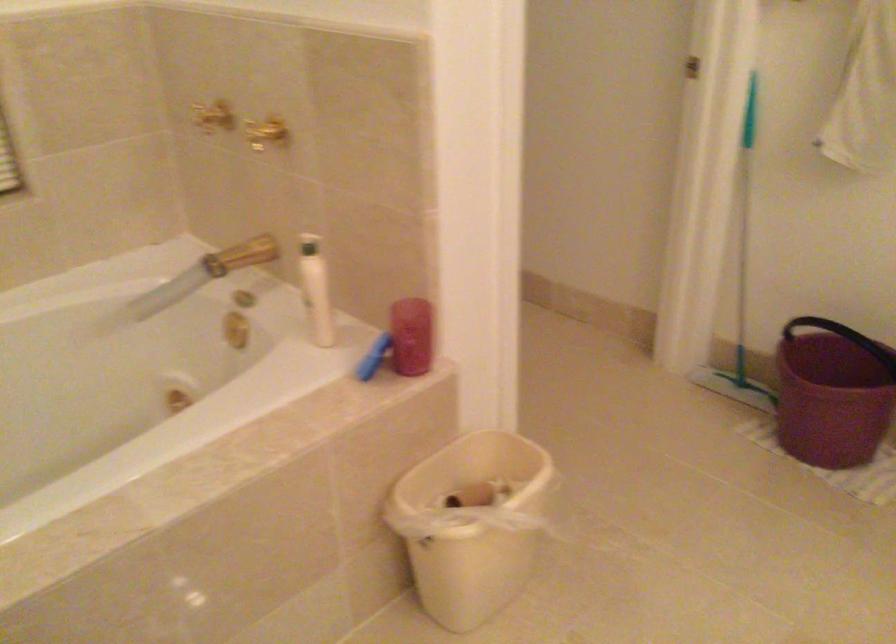
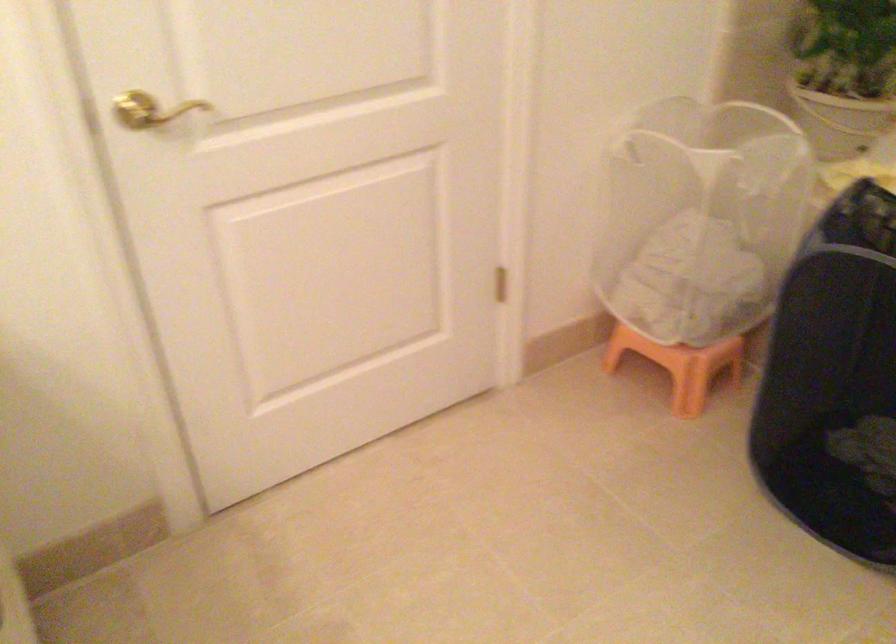
In the scene shown: The images are taken continuously from a first-person perspective. In which direction is your viewpoint rotating?

The camera rotated toward left-down.